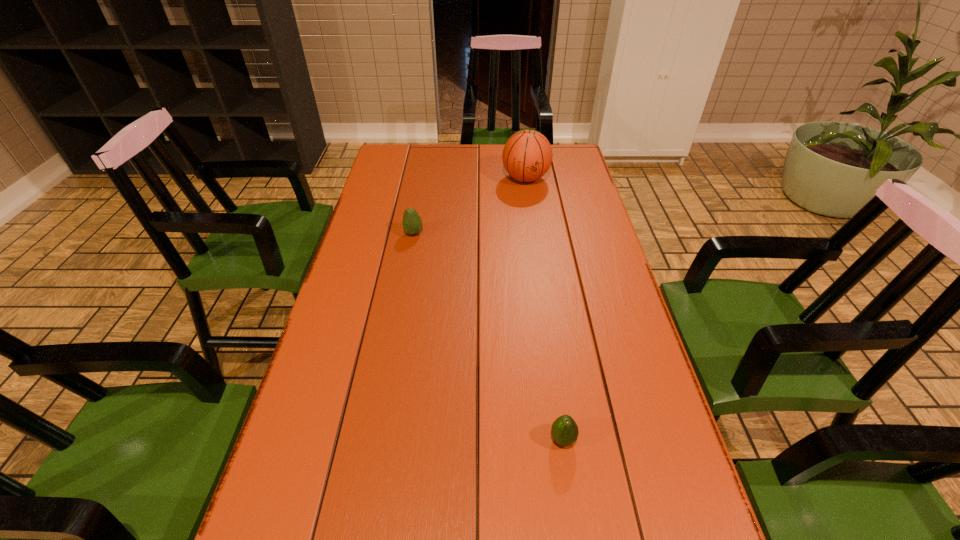
At what (x,y) coordinates should I click in order to perform the action: click on the farthest object. Please return your answer as a coordinate pair (x, y). This screenshot has height=540, width=960. Looking at the image, I should click on (527, 155).

The height and width of the screenshot is (540, 960). I want to click on basketball, so click(527, 155).

Locate an element on the screen. The width and height of the screenshot is (960, 540). the left avocado is located at coordinates (412, 224).

The image size is (960, 540). Find the location of `the second farthest object`. the second farthest object is located at coordinates (412, 224).

Where is `the shortest object`? The width and height of the screenshot is (960, 540). the shortest object is located at coordinates (564, 430).

The width and height of the screenshot is (960, 540). I want to click on the nearest object, so click(x=564, y=430).

You are a GUI agent. You are given a task and a screenshot of the screen. Output one action in this format:
    pyautogui.click(x=<x>, y=<y>)
    Task: Click on the vacant space situated 0.170m on the front of the basketball
    This screenshot has width=960, height=540.
    Given the screenshot: What is the action you would take?
    pyautogui.click(x=532, y=219)

Image resolution: width=960 pixels, height=540 pixels. Identify the location of vacant space located 0.120m on the back of the second nearest object. (419, 207).

The image size is (960, 540). Identify the location of vacant space located 0.360m on the left of the right avocado. (377, 439).

At what (x,y) coordinates should I click in order to perform the action: click on object that is at the far edge. Please return your answer as a coordinate pair (x, y). This screenshot has width=960, height=540. Looking at the image, I should click on (527, 155).